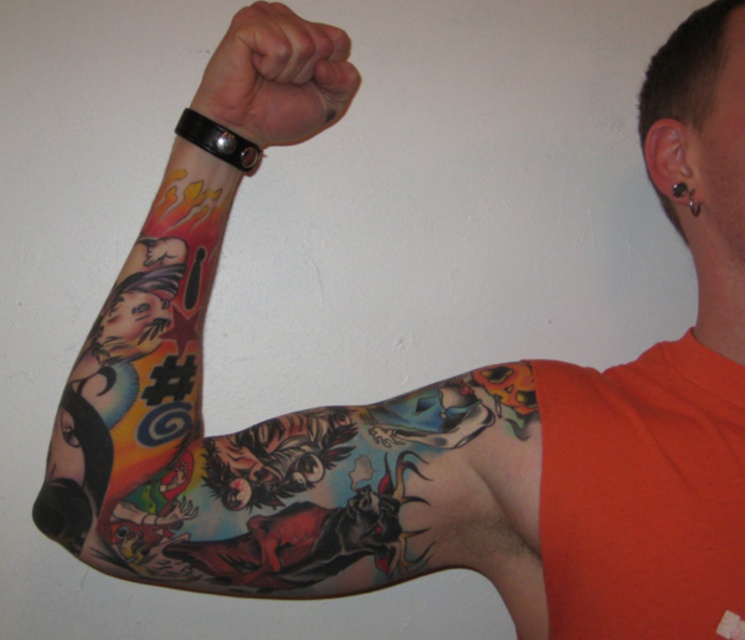
Question: Is colorful tattooed arm at upper left smaller than black leather wristband at upper center?

Choices:
 (A) yes
 (B) no

Answer: (B)

Question: Which point is farther from the camera taking this photo?

Choices:
 (A) (221, 60)
 (B) (305, 68)

Answer: (A)

Question: Is colorful tattooed arm at upper left below black leather wristband at upper center?

Choices:
 (A) no
 (B) yes

Answer: (B)

Question: Which object appears closest to the camera in this image?

Choices:
 (A) colorful tattooed arm at upper left
 (B) black leather wristband at upper center

Answer: (A)

Question: Which point is closer to the camera?

Choices:
 (A) (228, 42)
 (B) (107, 420)

Answer: (A)

Question: Is colorful tattooed arm at upper left closer to the viewer compared to black leather wristband at upper center?

Choices:
 (A) yes
 (B) no

Answer: (A)